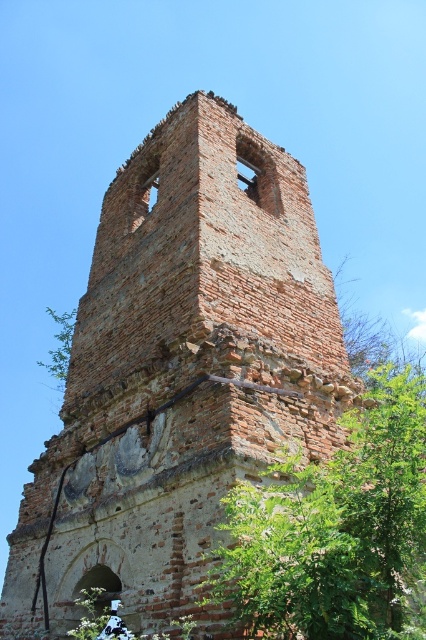
Question: Which of the following is the closest to the observer?

Choices:
 (A) (66, 317)
 (B) (239, 572)

Answer: (B)

Question: Considering the relative positions of green leafy tree at center and green leafy tree at left in the image provided, where is green leafy tree at center located with respect to green leafy tree at left?

Choices:
 (A) right
 (B) left

Answer: (A)

Question: Which of the following is the farthest from the observer?

Choices:
 (A) tap(60, 320)
 (B) tap(370, 378)

Answer: (A)

Question: Does green leafy tree at center have a larger size compared to green leafy tree at left?

Choices:
 (A) no
 (B) yes

Answer: (A)

Question: Does green leafy tree at center have a lesser width compared to green leafy tree at left?

Choices:
 (A) no
 (B) yes

Answer: (B)

Question: Which point is farther from the camera taking this photo?

Choices:
 (A) (46, 310)
 (B) (336, 612)

Answer: (A)